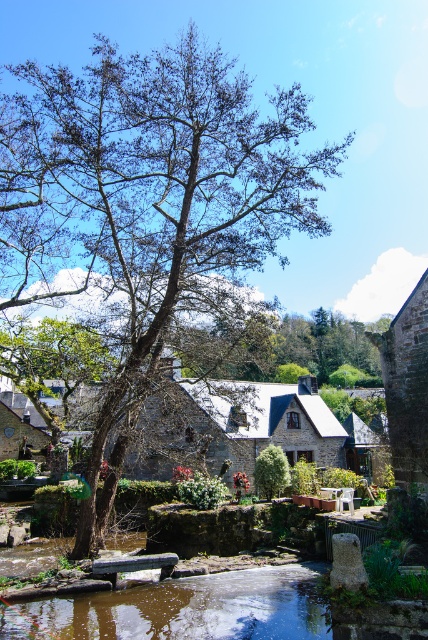
Can you confirm if stone village at center is taller than green wooden bench at center?

Correct, stone village at center is much taller as green wooden bench at center.

Based on the photo, is stone village at center smaller than green wooden bench at center?

Incorrect, stone village at center is not smaller in size than green wooden bench at center.

What are the coordinates of `stone village at center` in the screenshot? It's located at (258, 428).

Where is `stone village at center`? The image size is (428, 640). stone village at center is located at coordinates coord(258,428).

Is bare wood tree at center closer to camera compared to stone village at center?

Yes, it is.

Looking at this image, can you confirm if bare wood tree at center is positioned to the right of stone village at center?

No, bare wood tree at center is not to the right of stone village at center.

Does point (190, 326) come behind point (351, 449)?

No, it is in front of (351, 449).

Find the location of a particular element. Image resolution: width=428 pixels, height=640 pixels. bare wood tree at center is located at coordinates (148, 209).

Which is in front, point (128, 556) or point (288, 474)?

Point (128, 556) is more forward.

Find the location of a particular element. green wooden bench at center is located at coordinates (133, 566).

Locate an element on the screen. This screenshot has height=640, width=428. green wooden bench at center is located at coordinates (133, 566).